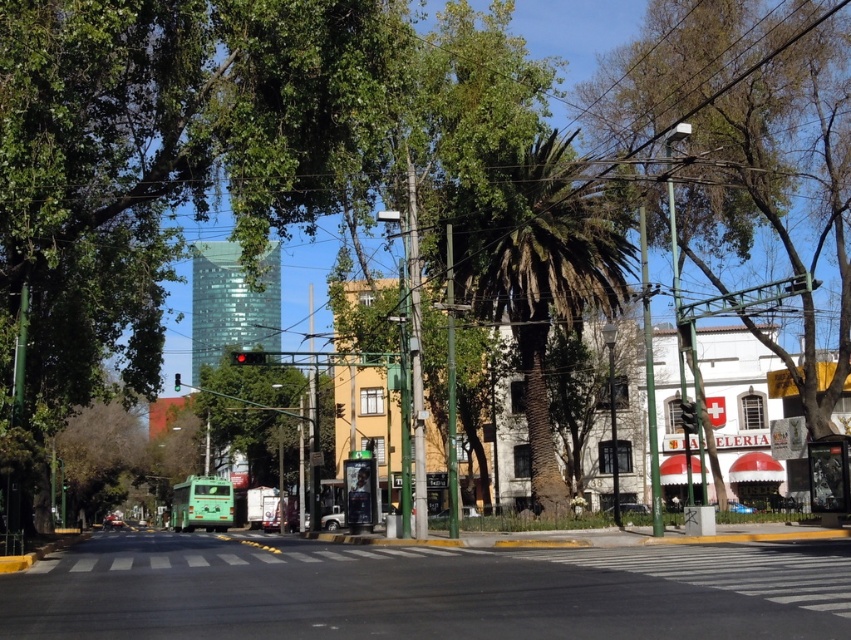
Who is lower down, black asphalt road at center or metallic silver car at center?

metallic silver car at center is lower down.

Can you confirm if black asphalt road at center is shorter than metallic silver car at center?

In fact, black asphalt road at center may be taller than metallic silver car at center.

Is point (333, 630) more distant than point (637, 512)?

That is False.

You are a GUI agent. You are given a task and a screenshot of the screen. Output one action in this format:
    pyautogui.click(x=<x>, y=<y>)
    Task: Click on the black asphalt road at center
    
    Given the screenshot: What is the action you would take?
    pyautogui.click(x=423, y=589)

Does black asphalt road at center appear over green leafy palm tree at center?

Actually, black asphalt road at center is below green leafy palm tree at center.

From the picture: How far apart are black asphalt road at center and green leafy palm tree at center?

12.06 meters

This screenshot has width=851, height=640. Identify the location of black asphalt road at center. (423, 589).

Does green leafy palm tree at center have a greater width compared to metallic silver car at center?

Yes, green leafy palm tree at center is wider than metallic silver car at center.

Does green leafy palm tree at center appear on the right side of metallic silver car at center?

In fact, green leafy palm tree at center is to the left of metallic silver car at center.

This screenshot has height=640, width=851. Find the location of `green leafy palm tree at center`. green leafy palm tree at center is located at coordinates (540, 273).

Locate an element on the screen. green leafy palm tree at center is located at coordinates (540, 273).